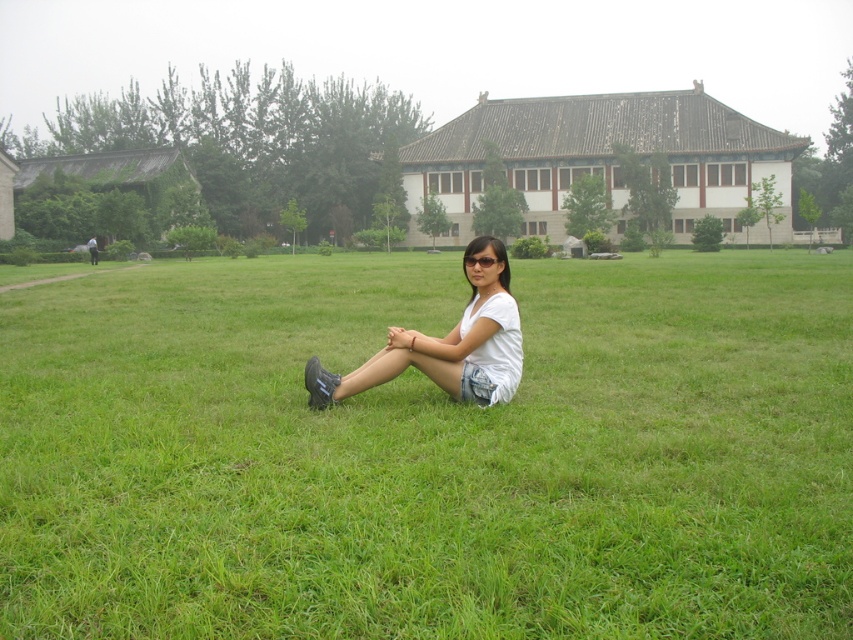
You are standing in the park and see two points marked on the grassy field. The first point is at coordinate point (782, 337), and the second point is at coordinate point (485, 240). Which point is closer to you?

Point (485, 240) is closer to you because it is less further to the camera than point (782, 337).

You are standing in the park and see the green grass at center and the white cotton shirt at center. Which object is closer to you?

The green grass at center is closer to the viewer than the white cotton shirt at center.

You are standing at the edge of the grassy field and want to reach the person sitting on the green grass at center. Which direction should you walk to get to them?

The green grass at center is located at point (428, 452), so you should walk towards the center of the field to reach the person sitting there.